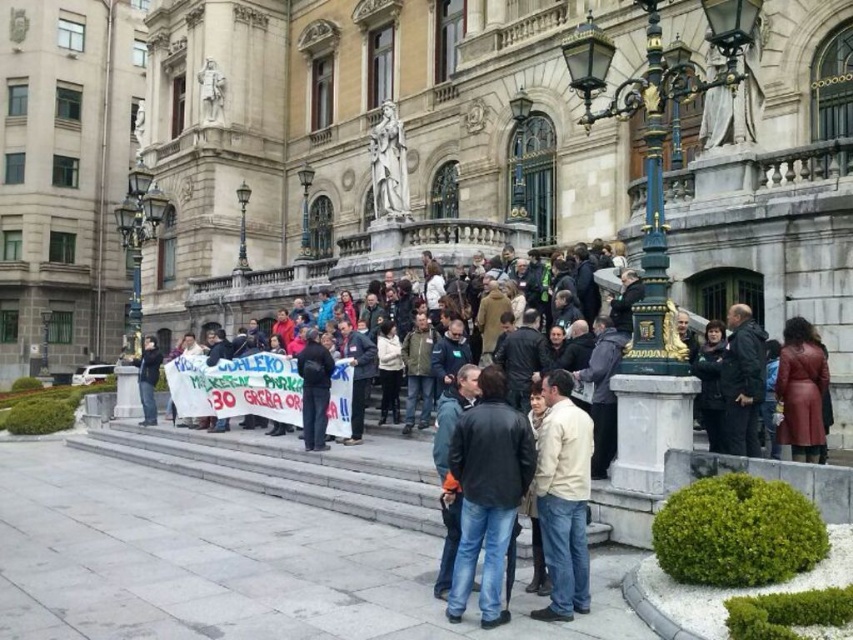
You are a photographer at the scene of a protest in front of a historic building. You need to capture a photo that includes both the dark blue leather jacket at center and the light brown leather jacket at center. Which jacket should you adjust your camera angle to ensure it appears taller in the photo?

The dark blue leather jacket at center is already much taller than the light brown leather jacket at center, so you should adjust your camera angle to ensure the dark blue leather jacket at center appears taller in the photo.

Based on the photo, what is the color and material of the object located at point (x=563, y=497)?

The object at point (x=563, y=497) is a light brown leather jacket.